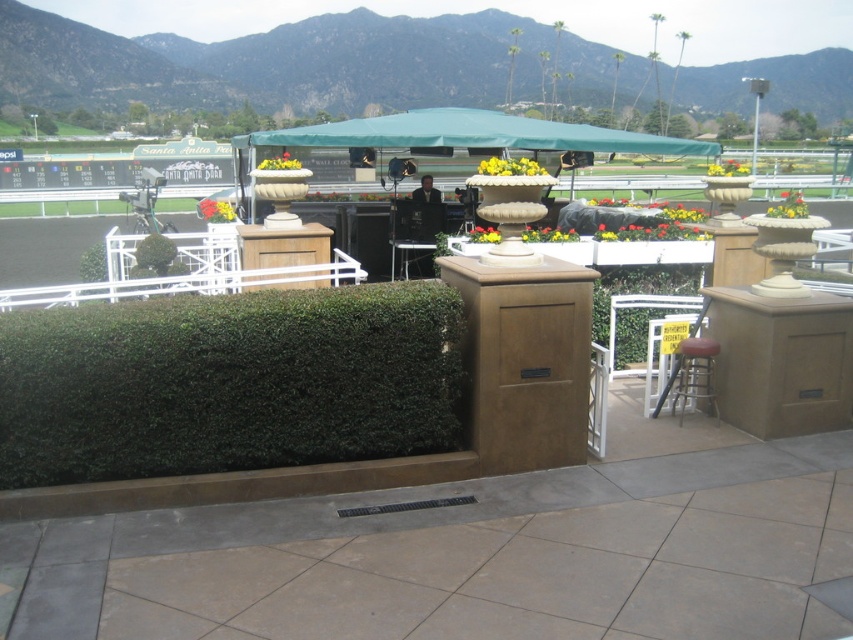
Which is above, green textured hedge at center or metallic silver stool at lower right?

green textured hedge at center

Can you confirm if green textured hedge at center is bigger than metallic silver stool at lower right?

Correct, green textured hedge at center is larger in size than metallic silver stool at lower right.

Is point (19, 465) closer to camera compared to point (686, 371)?

Yes, it is in front of point (686, 371).

Image resolution: width=853 pixels, height=640 pixels. I want to click on green textured hedge at center, so click(229, 381).

Is wooden at center smaller than metallic silver chair at center?

No, wooden at center is not smaller than metallic silver chair at center.

Is wooden at center taller than metallic silver chair at center?

Incorrect, wooden at center's height is not larger of metallic silver chair at center's.

Is point (260, 234) positioned before point (398, 211)?

Yes, it is.

In order to click on wooden at center in this screenshot , I will do `click(283, 246)`.

Between metallic silver chair at center and metallic silver stool at lower right, which one is positioned higher?

metallic silver chair at center

Is metallic silver chair at center to the right of metallic silver stool at lower right from the viewer's perspective?

Incorrect, metallic silver chair at center is not on the right side of metallic silver stool at lower right.

Which is in front, point (428, 228) or point (711, 356)?

Point (711, 356) is in front.

You are a GUI agent. You are given a task and a screenshot of the screen. Output one action in this format:
    pyautogui.click(x=<x>, y=<y>)
    Task: Click on the metallic silver chair at center
    This screenshot has width=853, height=640.
    Given the screenshot: What is the action you would take?
    pyautogui.click(x=413, y=232)